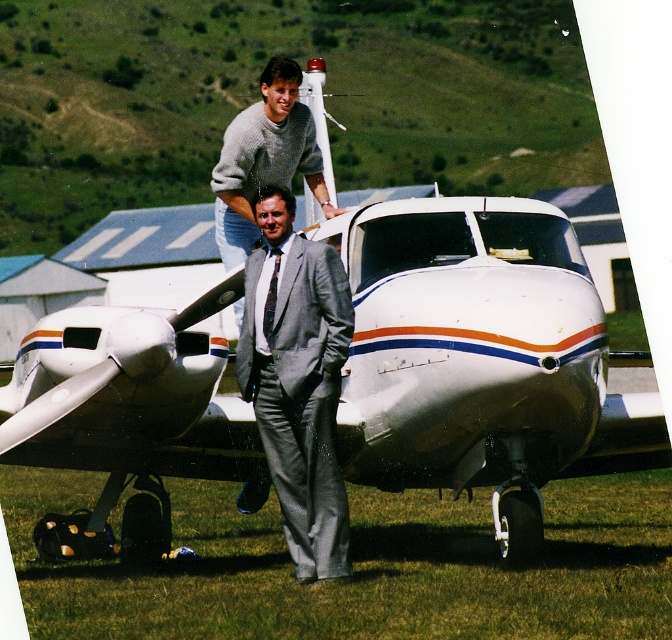
You are an airport security officer checking the positioning of passengers relative to the aircraft. You notice the gray suit at center and the patterned silk tie at center. Which one is positioned to the right side of the other?

The gray suit at center is to the right of the patterned silk tie at center.

You are a photographer trying to capture a closeup of both the knitted sweater at upper center and the patterned silk tie at center. Based on their positions, can you fit both into your camera frame without moving either subject?

The knitted sweater at upper center is 37.23 inches away from the patterned silk tie at center. Since this distance is relatively close, it should be possible to capture both in a single frame without moving them, provided the camera has an appropriate lens or zoom capability.